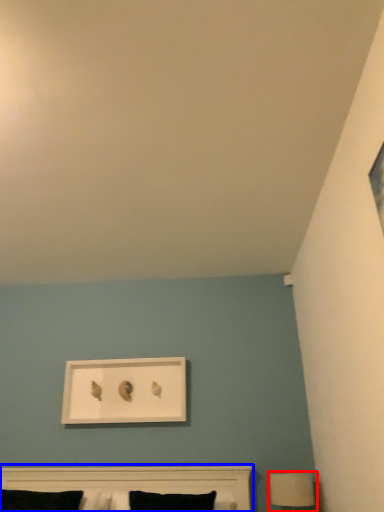
Question: Among these objects, which one is nearest to the camera, table lamp (highlighted by a red box) or bed (highlighted by a blue box)?

Choices:
 (A) table lamp
 (B) bed

Answer: (B)